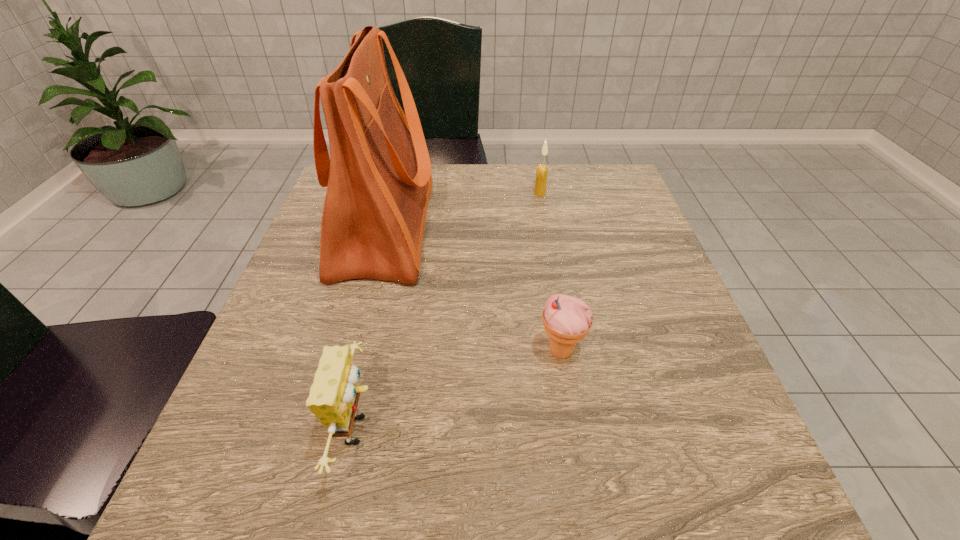
What are the coordinates of `object that is the second nearest to the nearest object` in the screenshot? It's located at (567, 320).

This screenshot has height=540, width=960. Identify the location of object that stands as the third closest to the candle. (334, 395).

At what (x,y) coordinates should I click in order to perform the action: click on vacant space that satisfies the following two spatial constraints: 1. on the front side of the candle; 2. on the front pocket of the shopping bag. Please return your answer as a coordinate pair (x, y). This screenshot has width=960, height=540. Looking at the image, I should click on (546, 228).

The height and width of the screenshot is (540, 960). I want to click on blank area in the image that satisfies the following two spatial constraints: 1. on the front pocket of the shopping bag; 2. on the right side of the icecream, so click(x=352, y=352).